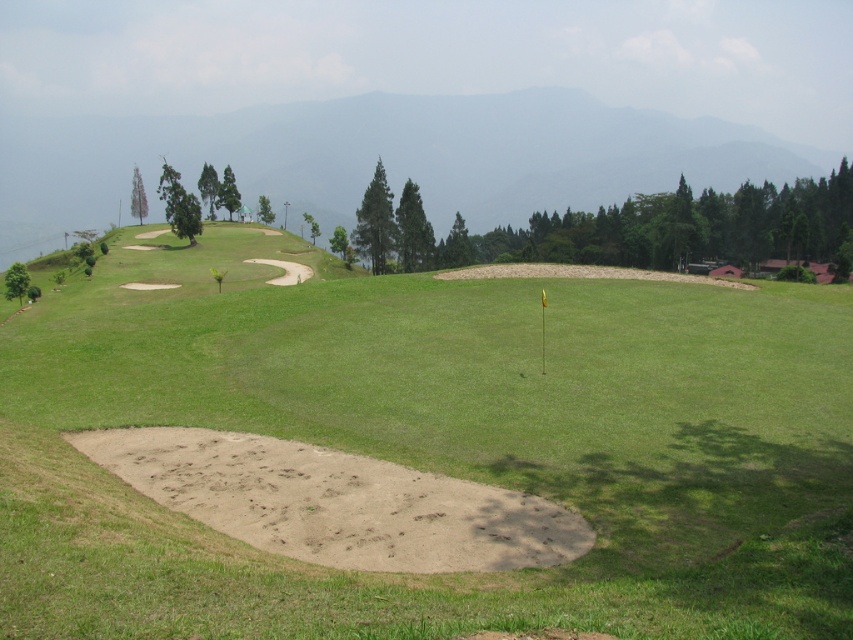
Does smooth sand trap at center appear over green grassy hillside at upper center?

No.

Which is behind, point (422, 316) or point (624, 164)?

Positioned behind is point (624, 164).

Does point (809, 524) come farther from viewer compared to point (554, 109)?

That is False.

Identify the location of smooth sand trap at center. (437, 448).